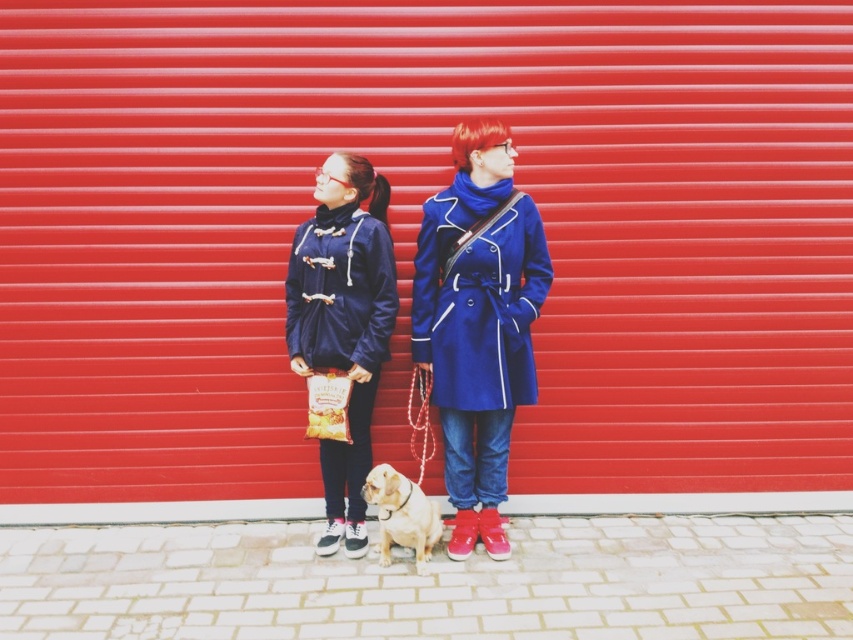
You are trying to decide which item to grab quickly between the navy blue fabric jacket at center and the golden fur dog at center. If you need to choose the wider one, which should you pick?

The navy blue fabric jacket at center is wider than the golden fur dog at center, so you should pick the navy blue fabric jacket at center.

You are taking a photo of the two people and the dog in the scene. You want to focus on the point closer to the camera. Which point should you choose between the point at coordinates (535, 218) and the point at coordinates (427, 291)?

You should choose the point at coordinates (535, 218) because it is closer to the camera than the point at coordinates (427, 291).

You are standing in front of a photo of two people and a dog. The photo has a red corrugated metal background. You want to know how far the navy blue fabric jacket at center is from you. Can you tell me?

The navy blue fabric jacket at center is 3.78 meters away from the viewer.